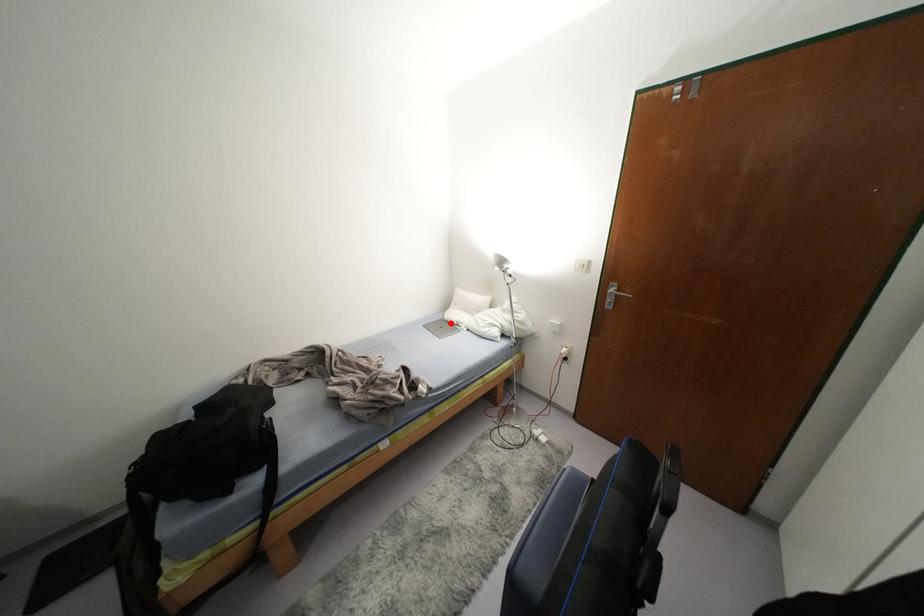
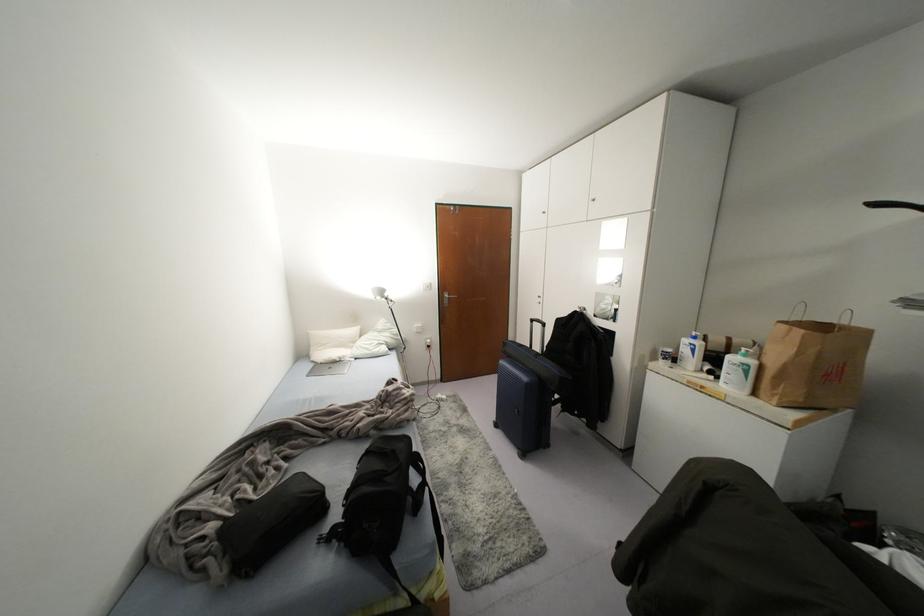
Find the pixel in the second image that matches the highlighted location in the first image.

(334, 361)